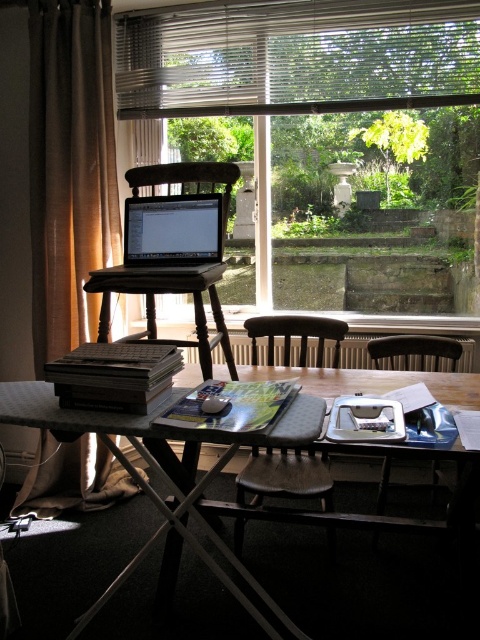
Question: Which point is closer to the camera?

Choices:
 (A) metallic blinds at upper center
 (B) wooden table at center

Answer: (B)

Question: Which of these objects is positioned closest to the wooden table at center?

Choices:
 (A) transparent glass window at center
 (B) metallic blinds at upper center
 (C) dark wood chair at center
 (D) wooden chair at center

Answer: (C)

Question: Is transparent glass window at center bigger than wooden chair at center?

Choices:
 (A) no
 (B) yes

Answer: (B)

Question: Does transparent glass window at center lie in front of wooden chair at center?

Choices:
 (A) no
 (B) yes

Answer: (A)

Question: Which point is closer to the camera taking this photo?

Choices:
 (A) pos(460,353)
 (B) pos(465,1)
 (C) pos(36,45)
 (D) pos(229,106)

Answer: (A)

Question: Does transparent glass window at center appear over wooden table at center?

Choices:
 (A) no
 (B) yes

Answer: (B)